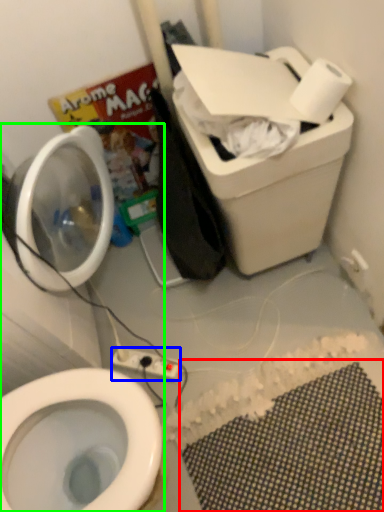
Question: Considering the real-world distances, which object is farthest from bath mat (highlighted by a red box)? electric outlet (highlighted by a blue box) or toiletries (highlighted by a green box)?

Choices:
 (A) electric outlet
 (B) toiletries

Answer: (B)